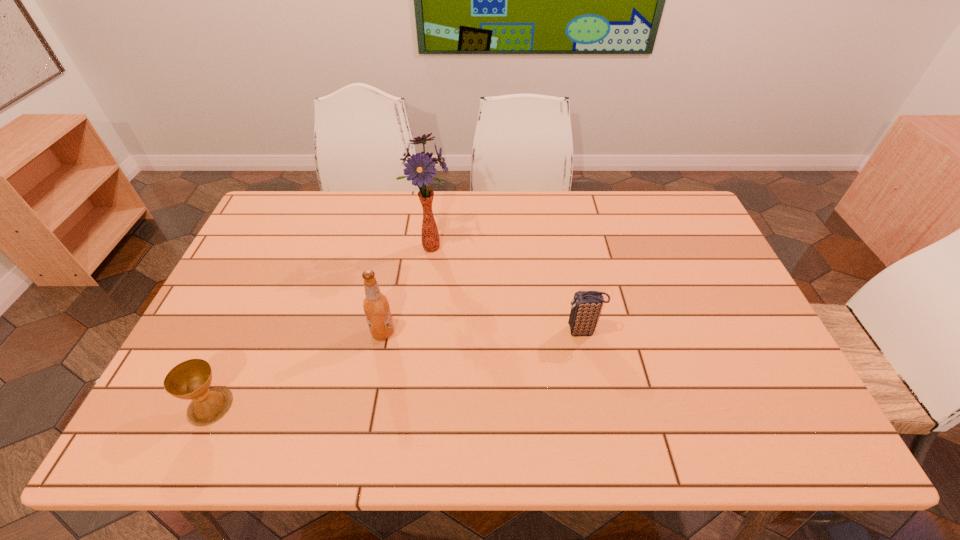
Locate an element on the screen. This screenshot has width=960, height=540. free space between the third shortest object and the third tallest object is located at coordinates (483, 332).

The height and width of the screenshot is (540, 960). What are the coordinates of `blank region between the beer bottle and the third tallest object` in the screenshot? It's located at (483, 332).

Identify the location of the third closest object to the rightmost object. Image resolution: width=960 pixels, height=540 pixels. (191, 379).

At what (x,y) coordinates should I click in order to perform the action: click on object that is the third closest to the clutch bag. Please return your answer as a coordinate pair (x, y). This screenshot has height=540, width=960. Looking at the image, I should click on (191, 379).